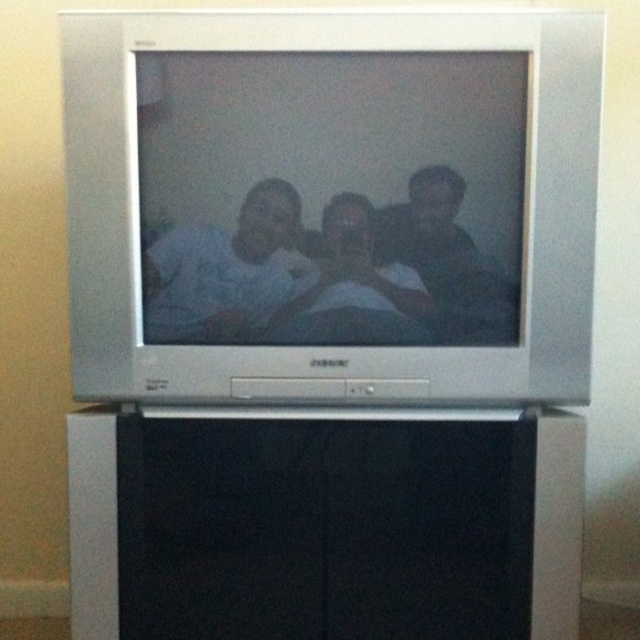
Consider the image. You are a delivery person who needs to place a new TV stand behind the silver metallic flat at center. Can you place it behind the existing black matte cabinet at lower center?

The silver metallic flat at center is in front of the black matte cabinet at lower center, so placing a new TV stand behind the silver metallic flat at center would actually place it behind the black matte cabinet at lower center as well. Therefore, it is possible to place the new TV stand there.

You are a photographer trying to capture a clear image of the silver metallic flat at center and the white matte shirt at center displayed on the CRT television screen. Since the subjects are slightly blurred, which object would you adjust the camera focus on first to ensure clarity?

The silver metallic flat at center is positioned over the white matte shirt at center, so adjusting focus on the silver metallic flat at center first would ensure clarity for the object in front.

You are looking at the CRT television screen showing the photo. The silver metallic flat at center and the matte white shirt at center are both visible. Which object is closer to the top edge of the television screen?

The silver metallic flat at center is located above the matte white shirt at center, so it is closer to the top edge of the television screen.